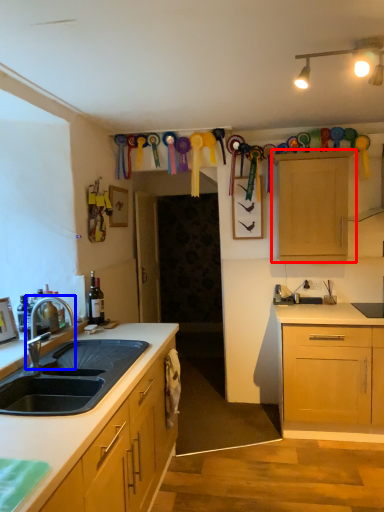
Question: Which object is further to the camera taking this photo, cabinetry (highlighted by a red box) or tap (highlighted by a blue box)?

Choices:
 (A) cabinetry
 (B) tap

Answer: (A)